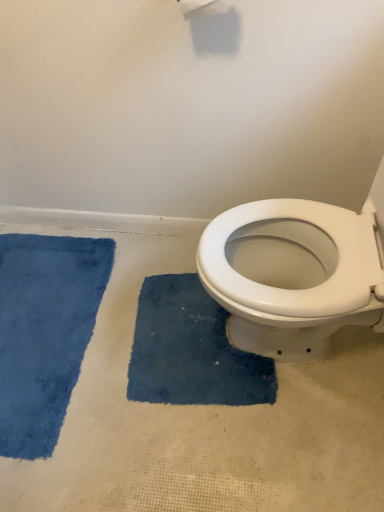
Question: Are blue plush bath mat at left, placed as the second bath mat when sorted from right to left, and blue plush bath mat at center, which appears as the 2th bath mat when viewed from the left, beside each other?

Choices:
 (A) yes
 (B) no

Answer: (B)

Question: Can you confirm if blue plush bath mat at left, placed as the second bath mat when sorted from right to left, is positioned to the right of blue plush bath mat at center, which appears as the 2th bath mat when viewed from the left?

Choices:
 (A) no
 (B) yes

Answer: (A)

Question: Is blue plush bath mat at left, which ranks as the first bath mat in left-to-right order, bigger than blue plush bath mat at center, which appears as the 2th bath mat when viewed from the left?

Choices:
 (A) yes
 (B) no

Answer: (A)

Question: Is blue plush bath mat at left, placed as the second bath mat when sorted from right to left, turned away from blue plush bath mat at center, the first bath mat positioned from the right?

Choices:
 (A) no
 (B) yes

Answer: (B)

Question: From the image's perspective, is blue plush bath mat at left, which ranks as the first bath mat in left-to-right order, located beneath blue plush bath mat at center, which appears as the 2th bath mat when viewed from the left?

Choices:
 (A) yes
 (B) no

Answer: (B)

Question: Is blue plush bath mat at left, placed as the second bath mat when sorted from right to left, not within blue plush bath mat at center, which appears as the 2th bath mat when viewed from the left?

Choices:
 (A) yes
 (B) no

Answer: (A)

Question: Is blue plush bath mat at left, placed as the second bath mat when sorted from right to left, at the back of blue plush bath mat at center, which appears as the 2th bath mat when viewed from the left?

Choices:
 (A) no
 (B) yes

Answer: (A)

Question: From a real-world perspective, is blue plush bath mat at center, the first bath mat positioned from the right, on blue plush bath mat at left, which ranks as the first bath mat in left-to-right order?

Choices:
 (A) no
 (B) yes

Answer: (A)

Question: Does blue plush bath mat at center, the first bath mat positioned from the right, appear on the right side of blue plush bath mat at left, which ranks as the first bath mat in left-to-right order?

Choices:
 (A) yes
 (B) no

Answer: (A)

Question: Does blue plush bath mat at center, the first bath mat positioned from the right, have a smaller size compared to blue plush bath mat at left, which ranks as the first bath mat in left-to-right order?

Choices:
 (A) no
 (B) yes

Answer: (B)

Question: Could blue plush bath mat at left, which ranks as the first bath mat in left-to-right order, be considered to be inside blue plush bath mat at center, the first bath mat positioned from the right?

Choices:
 (A) no
 (B) yes

Answer: (A)

Question: Does blue plush bath mat at center, the first bath mat positioned from the right, appear on the left side of blue plush bath mat at left, which ranks as the first bath mat in left-to-right order?

Choices:
 (A) yes
 (B) no

Answer: (B)

Question: From a real-world perspective, is blue plush bath mat at left, placed as the second bath mat when sorted from right to left, physically located above or below blue plush bath mat at center, which appears as the 2th bath mat when viewed from the left?

Choices:
 (A) above
 (B) below

Answer: (A)